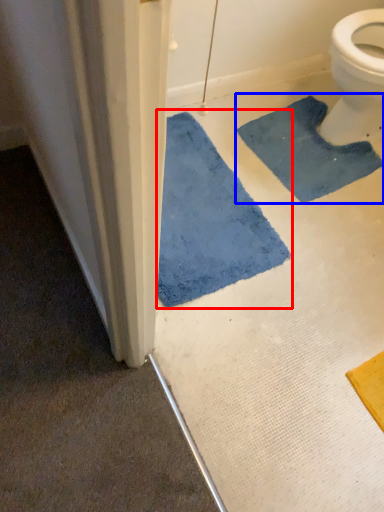
Question: Which object is closer to the camera taking this photo, bath mat (highlighted by a red box) or bath mat (highlighted by a blue box)?

Choices:
 (A) bath mat
 (B) bath mat

Answer: (A)